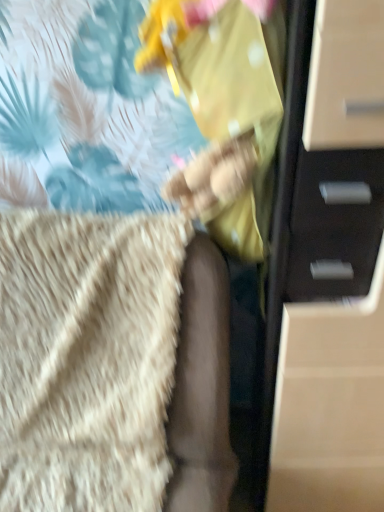
Question: From the image's perspective, is matte black chest of drawers at right located above or below beige fluffy blanket at lower left?

Choices:
 (A) above
 (B) below

Answer: (A)

Question: Is matte black chest of drawers at right bigger or smaller than beige fluffy blanket at lower left?

Choices:
 (A) big
 (B) small

Answer: (B)

Question: Would you say matte black chest of drawers at right is inside or outside beige fluffy blanket at lower left?

Choices:
 (A) outside
 (B) inside

Answer: (A)

Question: Considering the positions of point click(x=13, y=324) and point click(x=283, y=244), is point click(x=13, y=324) closer or farther from the camera than point click(x=283, y=244)?

Choices:
 (A) closer
 (B) farther

Answer: (B)

Question: In terms of height, does beige fluffy blanket at lower left look taller or shorter compared to matte black chest of drawers at right?

Choices:
 (A) short
 (B) tall

Answer: (A)

Question: Looking at their shapes, would you say beige fluffy blanket at lower left is wider or thinner than matte black chest of drawers at right?

Choices:
 (A) thin
 (B) wide

Answer: (B)

Question: From a real-world perspective, is beige fluffy blanket at lower left above or below matte black chest of drawers at right?

Choices:
 (A) below
 (B) above

Answer: (A)